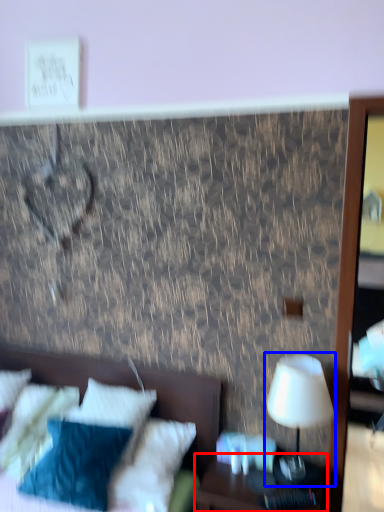
Question: Among these objects, which one is farthest to the camera, nightstand (highlighted by a red box) or table lamp (highlighted by a blue box)?

Choices:
 (A) nightstand
 (B) table lamp

Answer: (B)